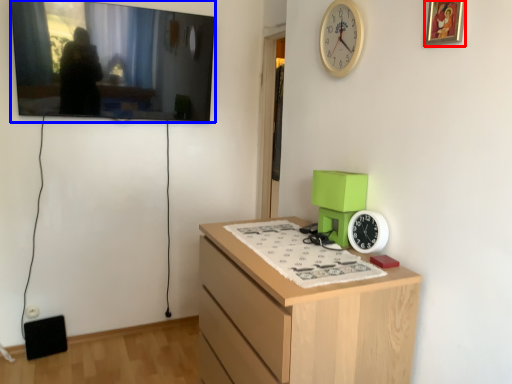
Question: Among these objects, which one is nearest to the camera, picture frame (highlighted by a red box) or picture frame (highlighted by a blue box)?

Choices:
 (A) picture frame
 (B) picture frame

Answer: (A)